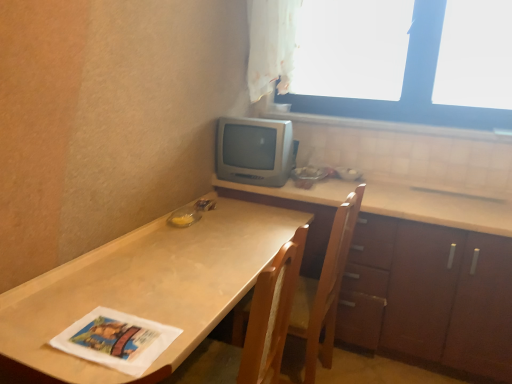
Locate an element on the screen. This screenshot has height=384, width=512. free location above wooden cabinet at right (from a real-world perspective) is located at coordinates click(x=416, y=201).